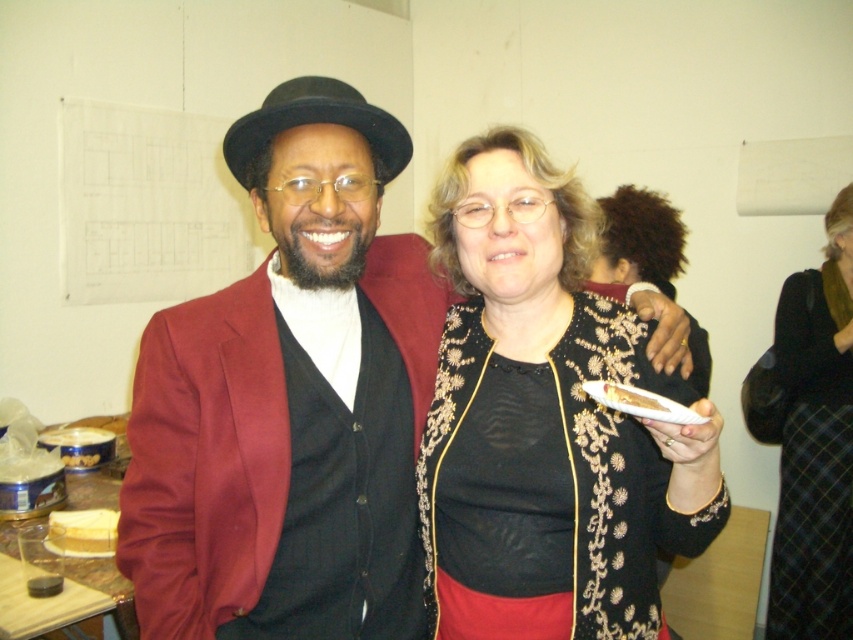
Question: Is shiny black hat at center further to the viewer compared to black embroidered jacket at center?

Choices:
 (A) yes
 (B) no

Answer: (A)

Question: Among these objects, which one is nearest to the camera?

Choices:
 (A) black embroidered jacket at center
 (B) black woolen skirt at lower right

Answer: (A)

Question: Estimate the real-world distances between objects in this image. Which object is farther from the shiny black hat at center?

Choices:
 (A) black woolen skirt at lower right
 (B) black embroidered jacket at center

Answer: (A)

Question: Can you confirm if shiny black hat at center is bigger than black embroidered jacket at center?

Choices:
 (A) yes
 (B) no

Answer: (B)

Question: Among these points, which one is farthest from the camera?

Choices:
 (A) (712, 456)
 (B) (773, 616)
 (C) (171, 358)

Answer: (B)

Question: From the image, what is the correct spatial relationship of shiny black hat at center in relation to black woolen skirt at lower right?

Choices:
 (A) right
 (B) left

Answer: (B)